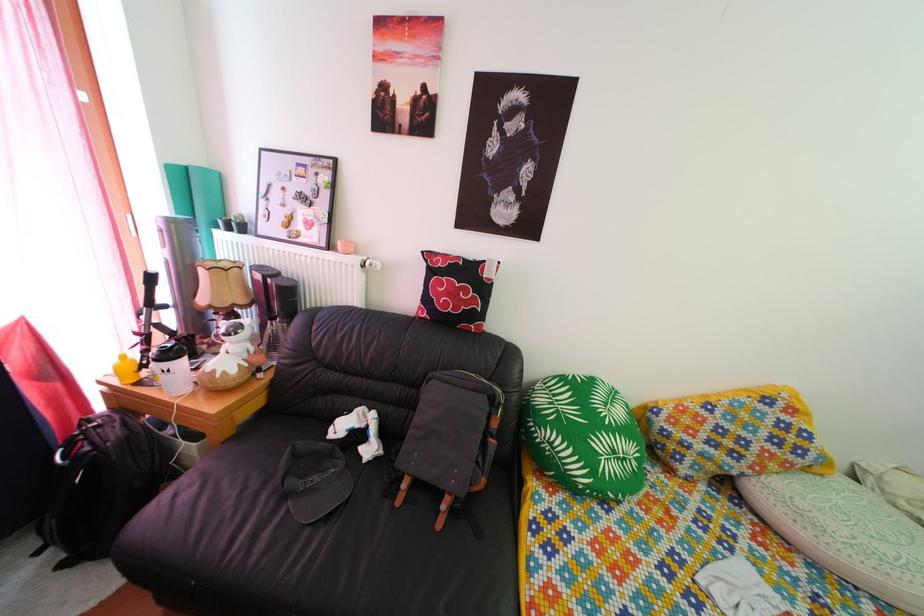
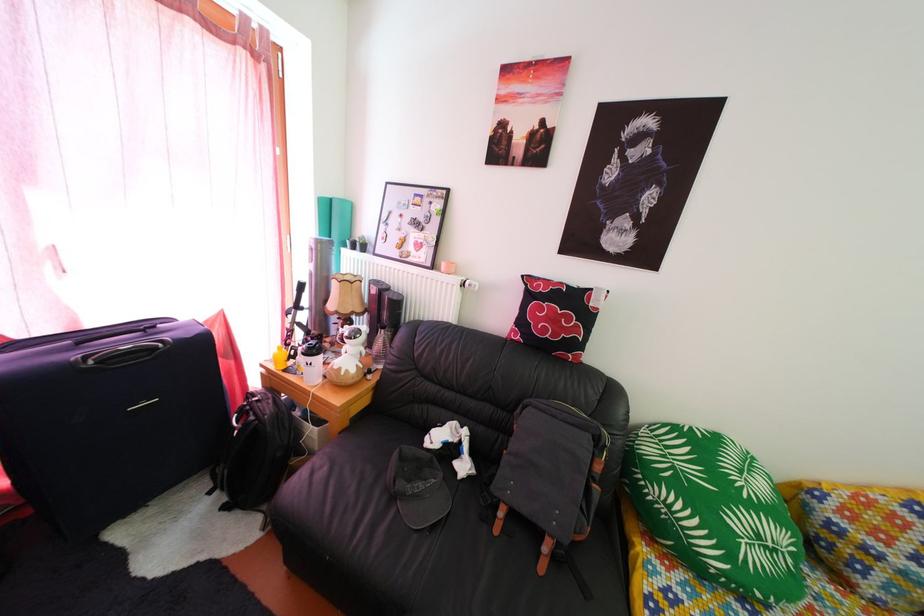
Question: The first image is from the beginning of the video and the second image is from the end. How did the camera likely rotate when shooting the video?

Choices:
 (A) Left
 (B) Right
 (C) Up
 (D) Down

Answer: (A)